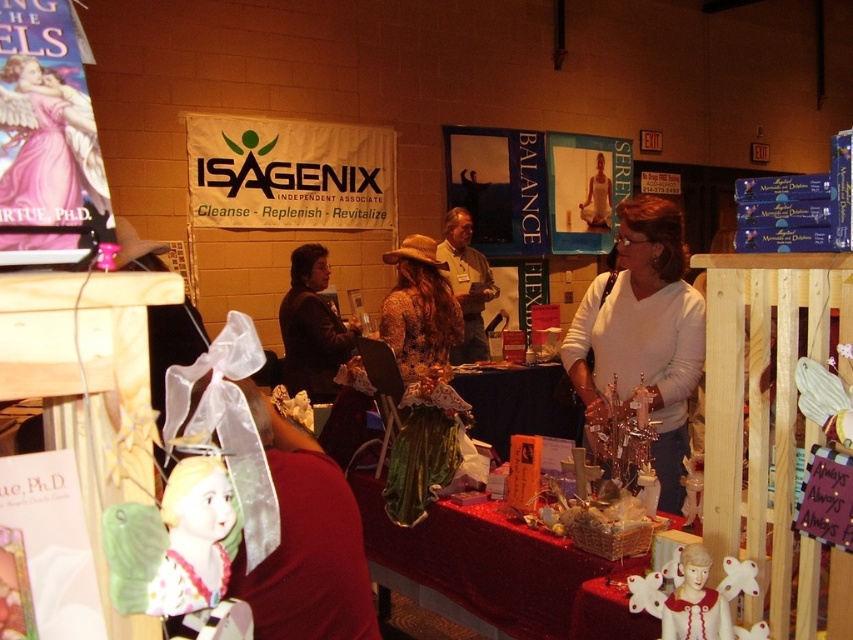
Question: Is shiny red fabric table at center below dark brown leather jacket at center?

Choices:
 (A) no
 (B) yes

Answer: (B)

Question: Which of the following is the closest to the observer?

Choices:
 (A) matte brown hat at center
 (B) white porcelain angel at center

Answer: (B)

Question: Considering the relative positions of white matte sweater at center and white porcelain angel at center in the image provided, where is white matte sweater at center located with respect to white porcelain angel at center?

Choices:
 (A) right
 (B) left

Answer: (A)

Question: Which is nearer to the porcelain doll at lower left?

Choices:
 (A) white porcelain angel at center
 (B) leather hat at center

Answer: (A)

Question: Which is nearer to the leather hat at center?

Choices:
 (A) white matte sweater at center
 (B) matte brown hat at center

Answer: (B)

Question: Is white porcelain angel at center bigger than dark brown leather jacket at center?

Choices:
 (A) yes
 (B) no

Answer: (B)